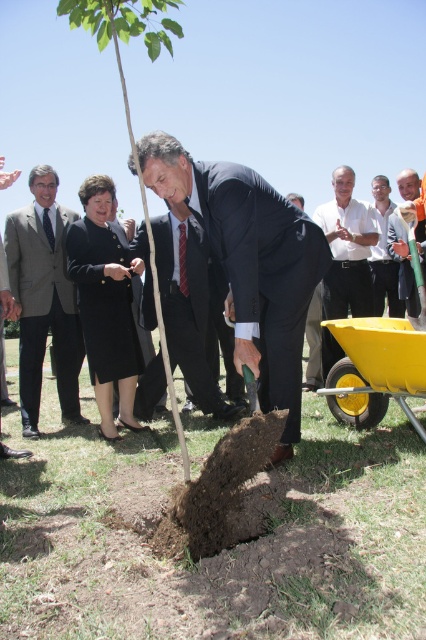
Question: Which is farther from the light brown suit at center?

Choices:
 (A) black wool coat at center
 (B) light brown wooden shovel at center

Answer: (B)

Question: Is black suit at center to the right of yellow plastic wagon at lower right from the viewer's perspective?

Choices:
 (A) no
 (B) yes

Answer: (A)

Question: Can you confirm if light brown suit at center is positioned above light brown wooden shovel at center?

Choices:
 (A) yes
 (B) no

Answer: (B)

Question: Can you confirm if yellow plastic wagon at lower right is smaller than black wool coat at center?

Choices:
 (A) no
 (B) yes

Answer: (A)

Question: Which of these objects is positioned closest to the white shirt at center?

Choices:
 (A) light brown wooden shovel at center
 (B) green leafy tree at center

Answer: (A)

Question: Which object is closer to the camera taking this photo?

Choices:
 (A) yellow plastic wagon at lower right
 (B) dark blue suit at center
 (C) green leafy tree at center

Answer: (C)